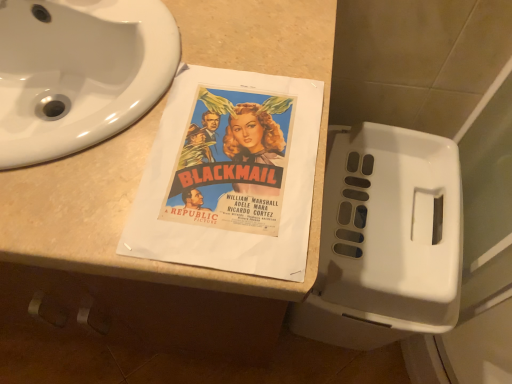
The image size is (512, 384). In order to click on white glossy sink at upper left in this screenshot , I will do `click(78, 73)`.

Identify the location of white plastic toilet at right. (386, 240).

In order to face white plastic toilet at right, should I rotate leftwards or rightwards?

To align with it, rotate right about 14.446°.

Identify the location of beige laminate counter top at center. (150, 148).

From the image's perspective, which one is positioned lower, white plastic toilet at right or beige laminate counter top at center?

white plastic toilet at right, from the image's perspective.

In terms of width, does white plastic toilet at right look wider or thinner when compared to beige laminate counter top at center?

In the image, white plastic toilet at right appears to be more narrow than beige laminate counter top at center.

Locate an element on the screen. counter top positioned vertically above the white plastic toilet at right (from a real-world perspective) is located at coordinates (150, 148).

Can you confirm if beige laminate counter top at center is smaller than white plastic toilet at right?

No.

From a real-world perspective, is beige laminate counter top at center physically located above or below white plastic toilet at right?

In terms of real-world spatial position, beige laminate counter top at center is above white plastic toilet at right.

Is beige laminate counter top at center wider or thinner than white plastic toilet at right?

Clearly, beige laminate counter top at center has more width compared to white plastic toilet at right.

Does beige laminate counter top at center have a greater height compared to white plastic toilet at right?

Indeed, beige laminate counter top at center has a greater height compared to white plastic toilet at right.

Considering the sizes of objects white glossy sink at upper left and white plastic toilet at right in the image provided, who is wider, white glossy sink at upper left or white plastic toilet at right?

With larger width is white plastic toilet at right.

This screenshot has width=512, height=384. I want to click on toilet on the right of white glossy sink at upper left, so click(386, 240).

Does white glossy sink at upper left turn towards white plastic toilet at right?

No, white glossy sink at upper left does not turn towards white plastic toilet at right.

How many degrees apart are the facing directions of beige laminate counter top at center and white glossy sink at upper left?

beige laminate counter top at center and white glossy sink at upper left are facing 1.04 degrees away from each other.

Which of these two, beige laminate counter top at center or white glossy sink at upper left, stands shorter?

With less height is white glossy sink at upper left.

Is beige laminate counter top at center bigger than white glossy sink at upper left?

Correct, beige laminate counter top at center is larger in size than white glossy sink at upper left.

Does white glossy sink at upper left have a lesser width compared to beige laminate counter top at center?

Yes, white glossy sink at upper left is thinner than beige laminate counter top at center.

From a real-world perspective, which is physically above, white glossy sink at upper left or beige laminate counter top at center?

From a 3D spatial view, white glossy sink at upper left is above.

Find the location of a particular element. Image resolution: width=512 pixels, height=384 pixels. sink that appears behind the beige laminate counter top at center is located at coordinates (78, 73).

From a real-world perspective, is white plastic toilet at right positioned under white glossy sink at upper left based on gravity?

Indeed, from a real-world perspective, white plastic toilet at right is positioned beneath white glossy sink at upper left.

Is white plastic toilet at right far away from white glossy sink at upper left?

That's not correct — white plastic toilet at right is a little close to white glossy sink at upper left.

Considering the relative sizes of white plastic toilet at right and white glossy sink at upper left in the image provided, is white plastic toilet at right smaller than white glossy sink at upper left?

Actually, white plastic toilet at right might be larger than white glossy sink at upper left.

The image size is (512, 384). In order to click on toilet that appears on the right of beige laminate counter top at center in this screenshot , I will do `click(386, 240)`.

The height and width of the screenshot is (384, 512). I want to click on counter top in front of the white plastic toilet at right, so click(150, 148).

Looking at the image, which one is located further to white plastic toilet at right, white glossy sink at upper left or beige laminate counter top at center?

Based on the image, white glossy sink at upper left appears to be further to white plastic toilet at right.

Estimate the real-world distances between objects in this image. Which object is closer to white plastic toilet at right, beige laminate counter top at center or white glossy sink at upper left?

beige laminate counter top at center is closer to white plastic toilet at right.

When comparing their distances from beige laminate counter top at center, does white plastic toilet at right or white glossy sink at upper left seem further?

The object further to beige laminate counter top at center is white plastic toilet at right.

Based on their spatial positions, is beige laminate counter top at center or white plastic toilet at right closer to white glossy sink at upper left?

beige laminate counter top at center is positioned closer to the anchor white glossy sink at upper left.

Which object lies nearer to the anchor point beige laminate counter top at center, white glossy sink at upper left or white plastic toilet at right?

Among the two, white glossy sink at upper left is located nearer to beige laminate counter top at center.

When comparing their distances from white glossy sink at upper left, does white plastic toilet at right or beige laminate counter top at center seem further?

Based on the image, white plastic toilet at right appears to be further to white glossy sink at upper left.

Locate an element on the screen. The image size is (512, 384). sink located between beige laminate counter top at center and white plastic toilet at right in the left-right direction is located at coordinates (78, 73).